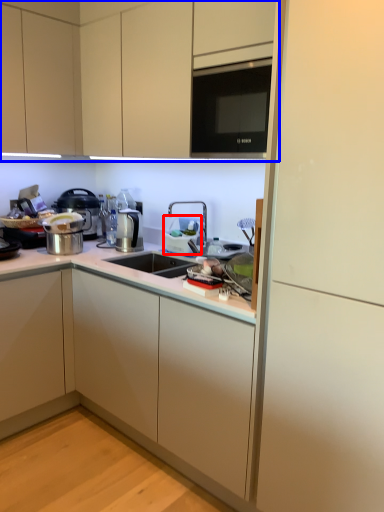
Question: Which object appears closest to the camera in this image, appliance (highlighted by a red box) or cabinetry (highlighted by a blue box)?

Choices:
 (A) appliance
 (B) cabinetry

Answer: (B)